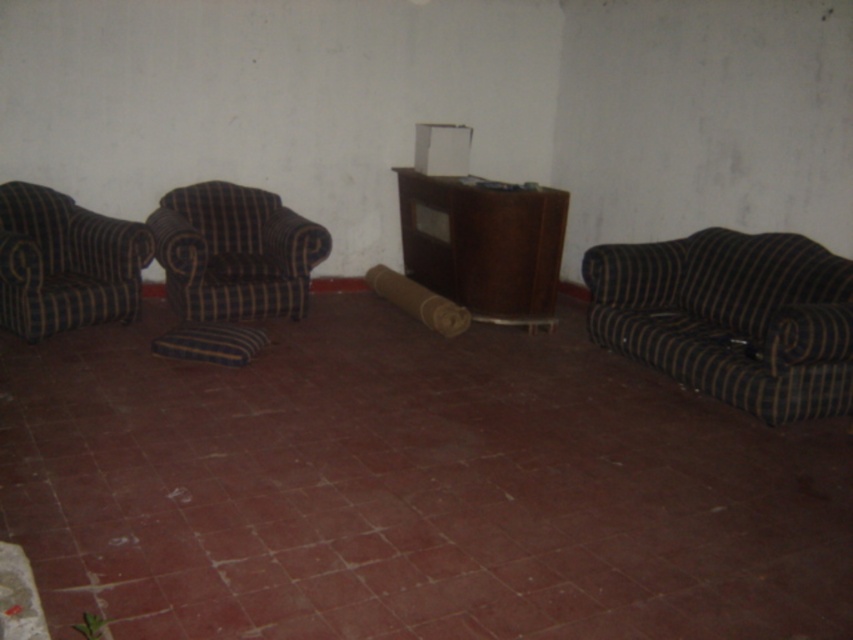
You are organizing a small gathering and need to place a 1.5 meter long tablecloth on either the brown striped armchair at left or the blue striped pillow at lower right. Which object can the tablecloth fit over entirely without hanging off the edges?

The brown striped armchair at left is bigger than the blue striped pillow at lower right, so the tablecloth can fit over the brown striped armchair at left entirely without hanging off the edges.

In the scene shown: You are a delivery person who needs to place a package between the brown striped armchair at left and the blue striped pillow at lower right. Can you fit the package in the space between them if the package requires 9 feet of space?

The distance between the brown striped armchair at left and the blue striped pillow at lower right is 8.94 feet, which is slightly less than the required 9 feet. Therefore, the package cannot be placed in the space between them.